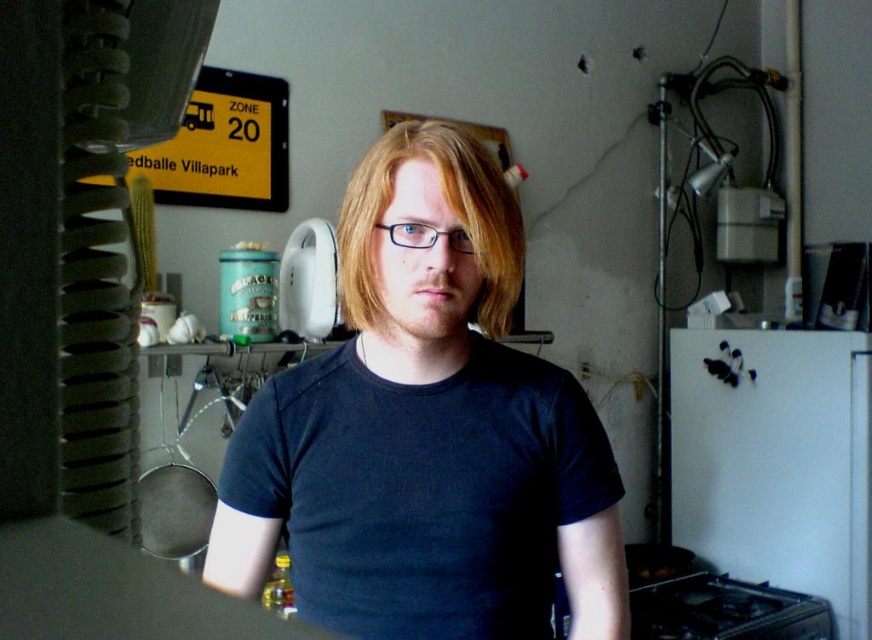
How distant is dark blue cotton t-shirt at center from blondehair at center?

The distance of dark blue cotton t-shirt at center from blondehair at center is 21.18 centimeters.

Which is in front, point (467, 388) or point (359, 284)?

Point (359, 284) is more forward.

Identify the location of dark blue cotton t-shirt at center. (421, 490).